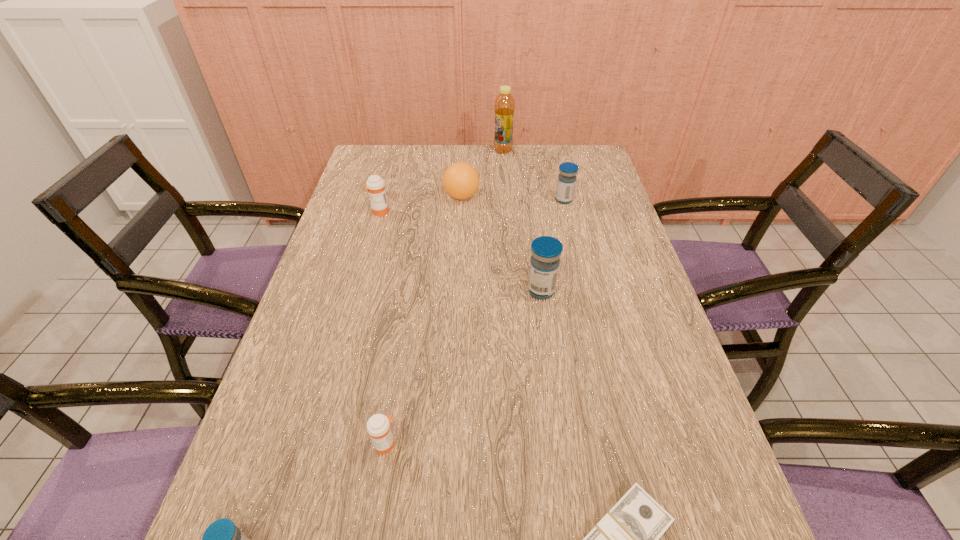
Where is `vacant point at the far edge`? The image size is (960, 540). vacant point at the far edge is located at coordinates (544, 149).

Where is `blank space at the left edge of the desktop`? blank space at the left edge of the desktop is located at coordinates (370, 200).

Image resolution: width=960 pixels, height=540 pixels. In the image, there is a desktop. Find the location of `vacant area at the right edge`. vacant area at the right edge is located at coordinates (651, 302).

Image resolution: width=960 pixels, height=540 pixels. I want to click on vacant space at the far right corner of the desktop, so click(x=577, y=157).

Identify the location of vacant area that lies between the third nearest medicine and the third nearest object. This screenshot has height=540, width=960. (464, 367).

Locate an element on the screen. Image resolution: width=960 pixels, height=540 pixels. free spot between the seventh shortest object and the ping-pong ball is located at coordinates (501, 244).

Identify the location of unoccupied area between the second nearest blue medicine and the fifth object from right to left. Image resolution: width=960 pixels, height=540 pixels. (x=501, y=244).

The width and height of the screenshot is (960, 540). I want to click on vacant space that is in between the tallest object and the left orange medicine, so click(441, 181).

You are a GUI agent. You are given a task and a screenshot of the screen. Output one action in this format:
    pyautogui.click(x=<x>, y=<y>)
    Task: Click on the object that is the fifth nearest to the right orange medicine
    
    Given the screenshot: What is the action you would take?
    pyautogui.click(x=461, y=180)

You are a GUI agent. You are given a task and a screenshot of the screen. Output one action in this format:
    pyautogui.click(x=<x>, y=<y>)
    Task: Click on the object that is the closest one to the dollar
    The image size is (960, 540).
    Given the screenshot: What is the action you would take?
    [378, 426]